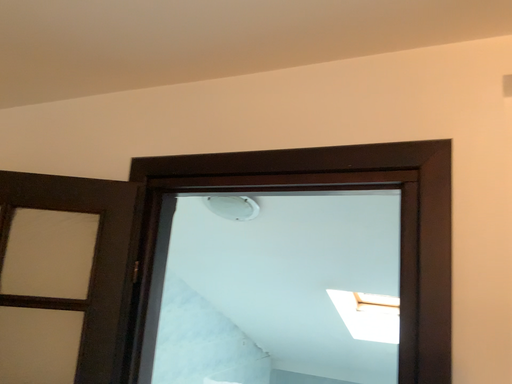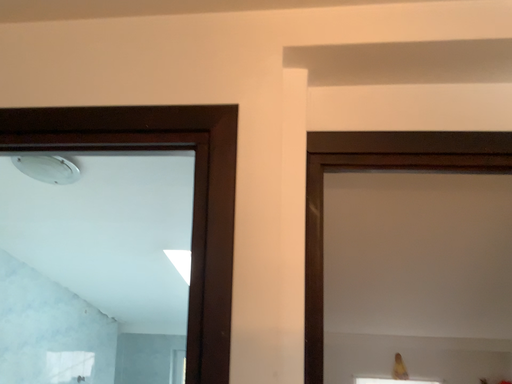
Question: How did the camera likely rotate when shooting the video?

Choices:
 (A) rotated right
 (B) rotated left

Answer: (A)